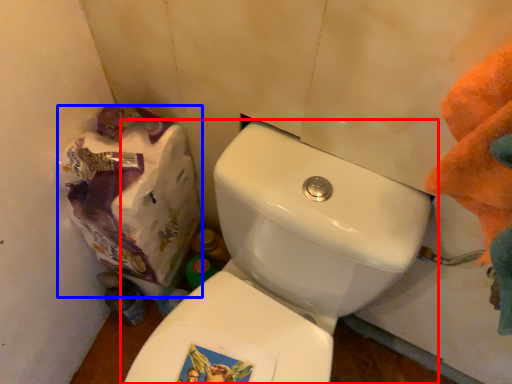
Question: Among these objects, which one is nearest to the camera, toilet (highlighted by a red box) or paper bag (highlighted by a blue box)?

Choices:
 (A) toilet
 (B) paper bag

Answer: (A)